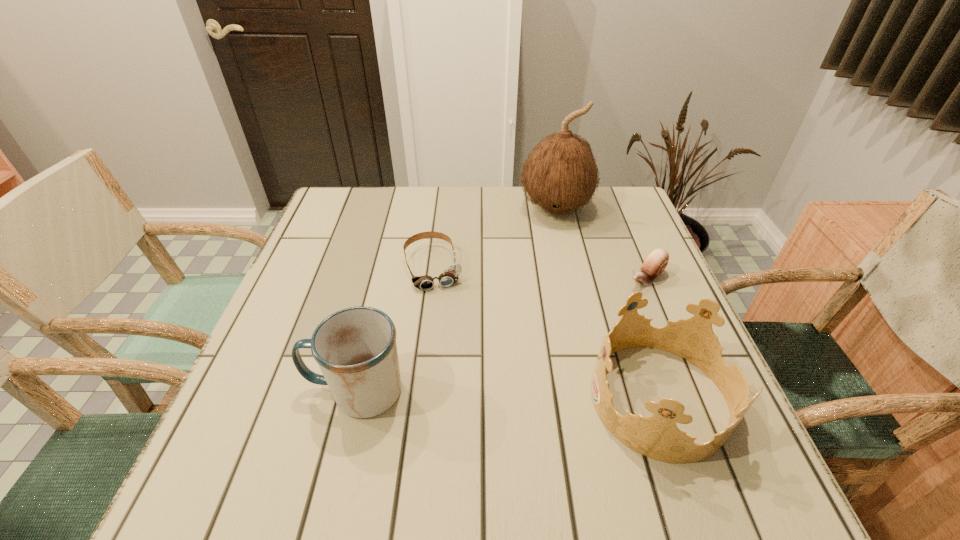
You are a GUI agent. You are given a task and a screenshot of the screen. Output one action in this format:
    pyautogui.click(x=<x>, y=<y>)
    Task: Click on the vacant region located 0.050m on the front-facing side of the tiara
    
    Given the screenshot: What is the action you would take?
    pyautogui.click(x=565, y=399)

Where is `vacant space located on the front-facing side of the shortest object`? Image resolution: width=960 pixels, height=540 pixels. vacant space located on the front-facing side of the shortest object is located at coordinates (448, 332).

Locate an element on the screen. The height and width of the screenshot is (540, 960). free space located 0.280m on the front-facing side of the shortest object is located at coordinates (464, 391).

Where is `free location located 0.160m on the front-facing side of the shortest object`? This screenshot has height=540, width=960. free location located 0.160m on the front-facing side of the shortest object is located at coordinates (451, 343).

Identify the location of free space located on the surface of the tallest object. The image size is (960, 540). (553, 320).

At what (x,y) coordinates should I click in order to perform the action: click on free space located 0.250m on the surface of the tallest object. Please return your answer as a coordinate pair (x, y). Looking at the image, I should click on (554, 292).

Locate an element on the screen. vacant region located 0.240m on the surface of the tallest object is located at coordinates (554, 289).

Where is `free space located 0.350m on the front-facing side of the escargot`? The height and width of the screenshot is (540, 960). free space located 0.350m on the front-facing side of the escargot is located at coordinates (524, 363).

The height and width of the screenshot is (540, 960). I want to click on free point located on the front-facing side of the escargot, so [520, 366].

You are a GUI agent. You are given a task and a screenshot of the screen. Output one action in this format:
    pyautogui.click(x=<x>, y=<y>)
    Task: Click on the vacant space located 0.270m on the front-facing side of the escargot
    This screenshot has width=960, height=540.
    Given the screenshot: What is the action you would take?
    pyautogui.click(x=552, y=343)